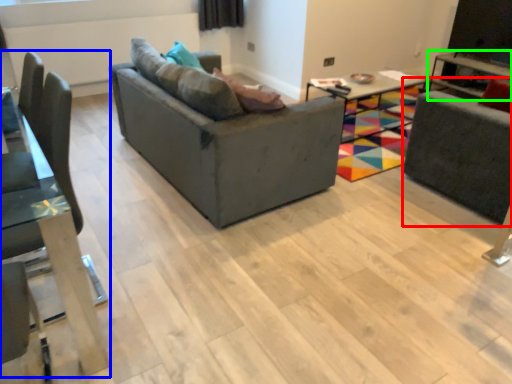
Question: Based on their relative distances, which object is nearer to swivel chair (highlighted by a red box)? Choose from chair (highlighted by a blue box) and table (highlighted by a green box).

Choices:
 (A) chair
 (B) table

Answer: (B)